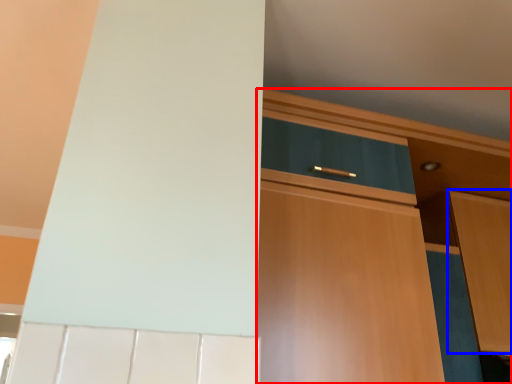
Question: Which of the following is the closest to the observer, cabinetry (highlighted by a red box) or cabinetry (highlighted by a blue box)?

Choices:
 (A) cabinetry
 (B) cabinetry

Answer: (A)